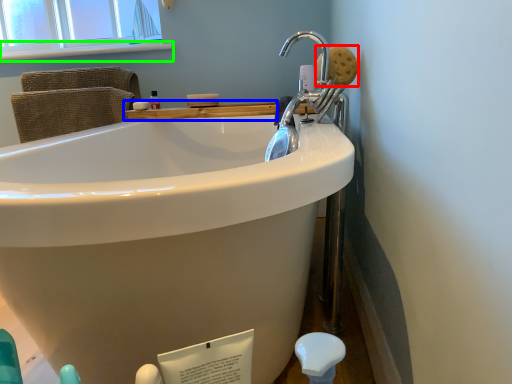
Question: Considering the real-world distances, which object is closest to soap (highlighted by a red box)? counter top (highlighted by a blue box) or window sill (highlighted by a green box).

Choices:
 (A) counter top
 (B) window sill

Answer: (A)